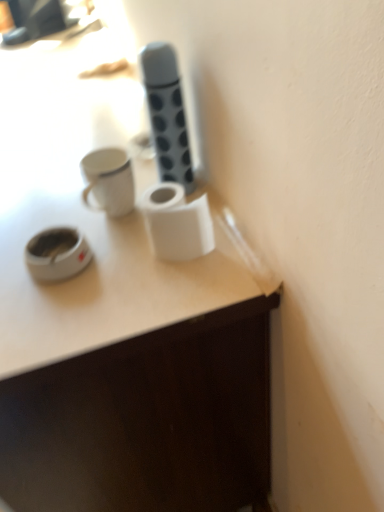
Find the location of `white matte paper towel at center`. white matte paper towel at center is located at coordinates (177, 223).

This screenshot has height=512, width=384. What do you see at coordinates (177, 223) in the screenshot? I see `white matte paper towel at center` at bounding box center [177, 223].

I want to click on white matte paper towel at center, so click(177, 223).